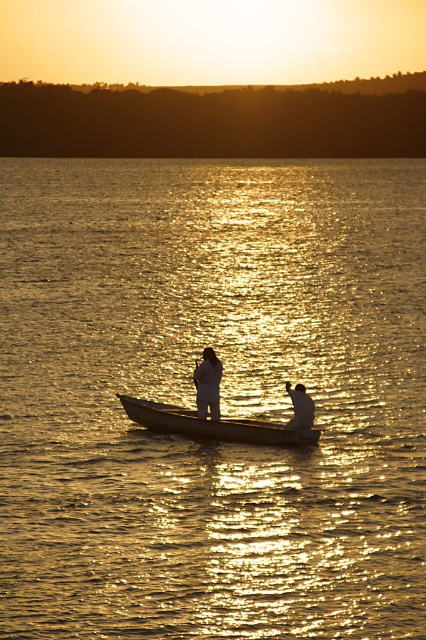
Question: Does shiny golden water at center have a greater width compared to wooden paddle at center?

Choices:
 (A) no
 (B) yes

Answer: (B)

Question: Is wooden paddle at center wider than silvery metallic rod at center?

Choices:
 (A) yes
 (B) no

Answer: (A)

Question: Which of the following is the closest to the observer?

Choices:
 (A) silvery metallic rod at center
 (B) shiny golden water at center

Answer: (B)

Question: Is shiny golden water at center positioned before wooden canoe at center?

Choices:
 (A) yes
 (B) no

Answer: (A)

Question: Among these points, which one is farthest from the camera?

Choices:
 (A) (181, 428)
 (B) (172, 236)

Answer: (B)

Question: Which point is closer to the camera?

Choices:
 (A) wooden paddle at center
 (B) silvery metallic rod at center

Answer: (B)